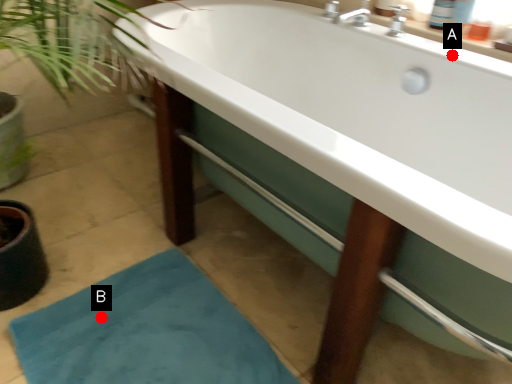
Question: Two points are circled on the image, labeled by A and B beside each circle. Which of the following is the farthest from the observer?

Choices:
 (A) A is further
 (B) B is further

Answer: (A)